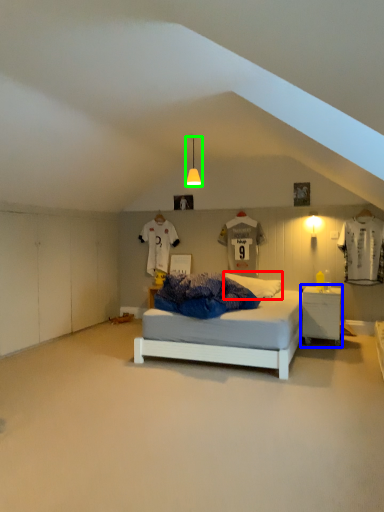
Question: Which object is positioned closest to pillow (highlighted by a red box)? Select from nightstand (highlighted by a blue box) and light fixture (highlighted by a green box).

Choices:
 (A) nightstand
 (B) light fixture

Answer: (A)